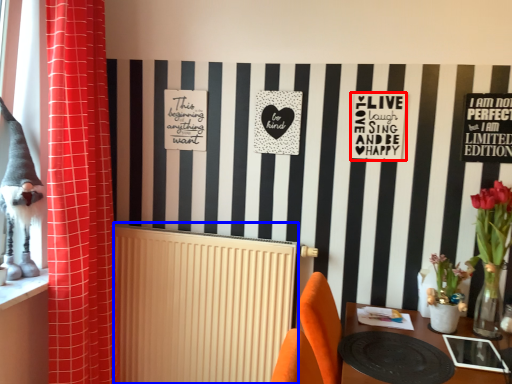
Question: Which object appears farthest to the camera in this image, postcard (highlighted by a red box) or radiator (highlighted by a blue box)?

Choices:
 (A) postcard
 (B) radiator

Answer: (B)